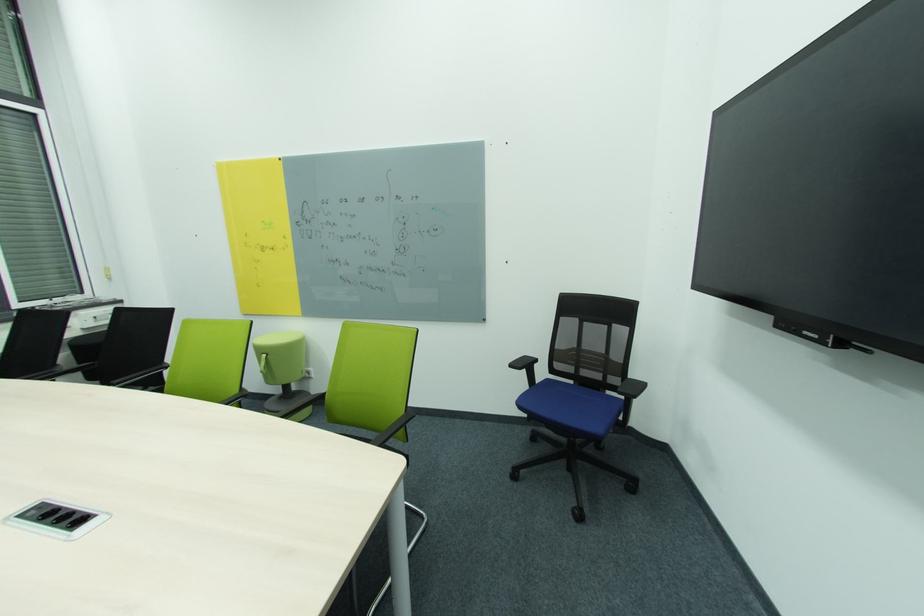
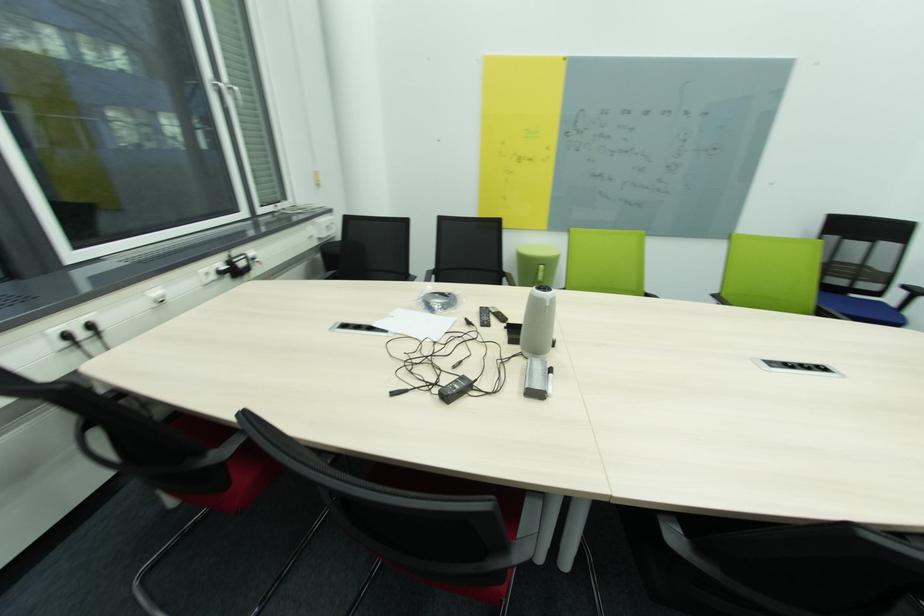
Question: The images are taken continuously from a first-person perspective. In which direction are you moving?

Choices:
 (A) Left
 (B) Right
 (C) Forward
 (D) Backward

Answer: (A)